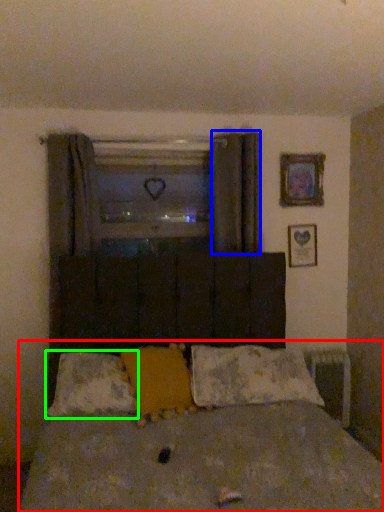
Question: Which is farther away from bed (highlighted by a red box)? curtain (highlighted by a blue box) or pillow (highlighted by a green box)?

Choices:
 (A) curtain
 (B) pillow

Answer: (A)